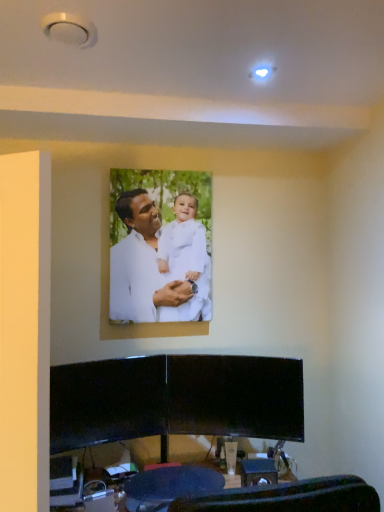
Question: Can you confirm if white matte/soft fabric man at center is thinner than black glossy entertainment center at lower center?

Choices:
 (A) no
 (B) yes

Answer: (B)

Question: Is black glossy entertainment center at lower center located within white matte/soft fabric man at center?

Choices:
 (A) yes
 (B) no

Answer: (B)

Question: From the image's perspective, does white matte/soft fabric man at center appear lower than black glossy entertainment center at lower center?

Choices:
 (A) yes
 (B) no

Answer: (B)

Question: From the image's perspective, is white matte/soft fabric man at center on top of black glossy entertainment center at lower center?

Choices:
 (A) yes
 (B) no

Answer: (A)

Question: Are white matte/soft fabric man at center and black glossy entertainment center at lower center beside each other?

Choices:
 (A) no
 (B) yes

Answer: (A)

Question: Is dark blue fabric swivel chair at lower center inside the boundaries of white matte/soft fabric man at center, or outside?

Choices:
 (A) outside
 (B) inside

Answer: (A)

Question: Is dark blue fabric swivel chair at lower center taller or shorter than white matte/soft fabric man at center?

Choices:
 (A) short
 (B) tall

Answer: (A)

Question: From the image's perspective, is dark blue fabric swivel chair at lower center positioned above or below white matte/soft fabric man at center?

Choices:
 (A) below
 (B) above

Answer: (A)

Question: From a real-world perspective, is dark blue fabric swivel chair at lower center positioned above or below white matte/soft fabric man at center?

Choices:
 (A) below
 (B) above

Answer: (A)

Question: Would you say white matte/soft fabric man at center is to the left or to the right of black glossy entertainment center at lower center in the picture?

Choices:
 (A) right
 (B) left

Answer: (B)

Question: Is white matte/soft fabric man at center taller or shorter than black glossy entertainment center at lower center?

Choices:
 (A) tall
 (B) short

Answer: (A)

Question: Considering the positions of white matte/soft fabric man at center and black glossy entertainment center at lower center in the image, is white matte/soft fabric man at center wider or thinner than black glossy entertainment center at lower center?

Choices:
 (A) wide
 (B) thin

Answer: (B)

Question: From the image's perspective, is white matte/soft fabric man at center above or below black glossy entertainment center at lower center?

Choices:
 (A) below
 (B) above

Answer: (B)

Question: Relative to white matte/soft fabric man at center, is black glossy entertainment center at lower center in front or behind?

Choices:
 (A) front
 (B) behind

Answer: (A)

Question: From a real-world perspective, is black glossy entertainment center at lower center above or below white matte/soft fabric man at center?

Choices:
 (A) below
 (B) above

Answer: (A)